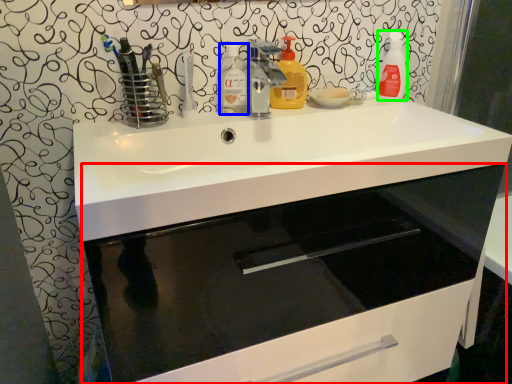
Question: Which is nearer to the bathroom cabinet (highlighted by a red box)? cleaning product (highlighted by a blue box) or cleaning product (highlighted by a green box).

Choices:
 (A) cleaning product
 (B) cleaning product

Answer: (B)